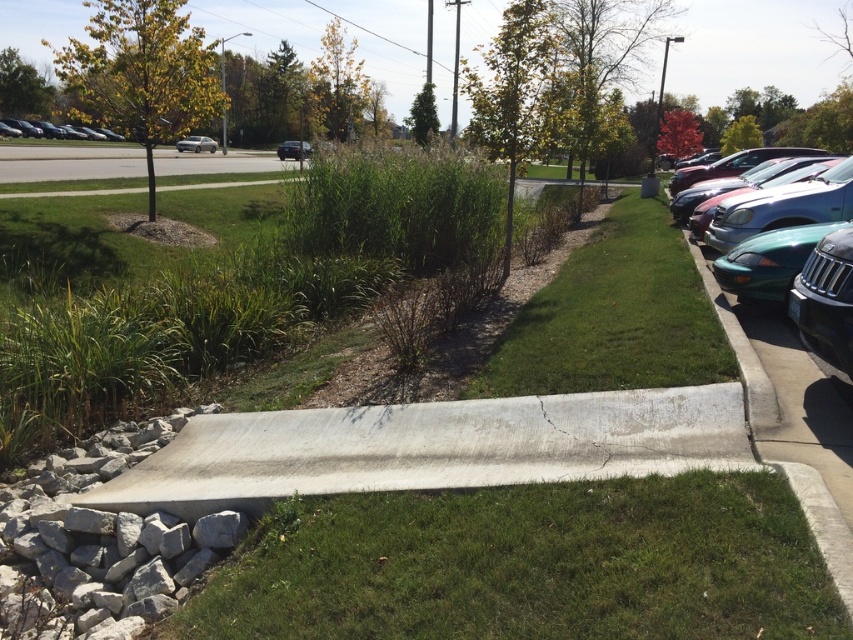
Is green grass at center taller than satin silver sedan at center-left?

In fact, green grass at center may be shorter than satin silver sedan at center-left.

Can you confirm if green grass at center is wider than satin silver sedan at center-left?

No.

This screenshot has height=640, width=853. Describe the element at coordinates (527, 564) in the screenshot. I see `green grass at center` at that location.

The height and width of the screenshot is (640, 853). Identify the location of green grass at center. (527, 564).

Does gray concrete curb at center lie in front of matte black car at left?

Yes, it is in front of matte black car at left.

Describe the element at coordinates (433, 448) in the screenshot. The image size is (853, 640). I see `gray concrete curb at center` at that location.

Where is `gray concrete curb at center`? This screenshot has height=640, width=853. gray concrete curb at center is located at coordinates (433, 448).

I want to click on gray concrete curb at center, so click(x=433, y=448).

Who is more forward, (747, 353) or (193, 145)?

Point (747, 353) is in front.

This screenshot has width=853, height=640. What do you see at coordinates (740, 353) in the screenshot?
I see `green concrete curb at right` at bounding box center [740, 353].

The width and height of the screenshot is (853, 640). I want to click on green concrete curb at right, so click(x=740, y=353).

I want to click on green concrete curb at right, so click(740, 353).